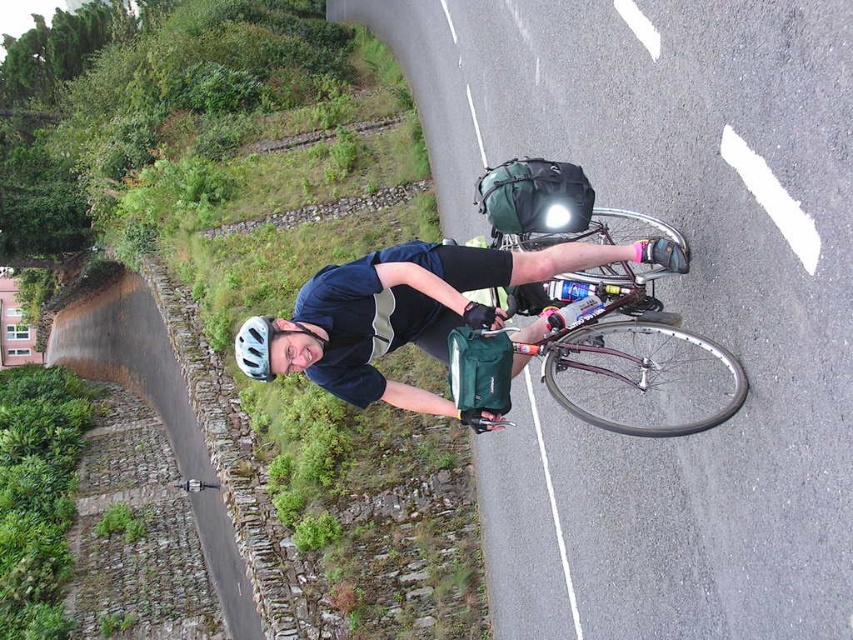
You are a delivery person who needs to carry both the shiny metallic bicycle at right and the white matte bicycle helmet at upper center in your van. The van has a loading width limit of 1.2 meters. Can you fit both items side by side without exceeding the width limit?

The shiny metallic bicycle at right might be wider than white matte bicycle helmet at upper center. Since the bicycle could be wider than 1.2 meters, it might exceed the van loading width limit. Therefore, it is uncertain if both items can fit side by side without exceeding the limit.

You are a cyclist who wants to place a small marker between the two points, point (312, 296) and point (250, 355). Which point is closer to you so you can start placing the marker from there?

Point (312, 296) is further to the viewer than point (250, 355), so the point closer to you is point (250, 355). Start placing the marker from there.

You are a cyclist who just arrived at a scenic spot and wants to take a photo of the matte black helmet at upper center. Where should you position yourself to capture the helmet in the frame?

To capture the matte black helmet at upper center in the frame, position yourself at point (418, 308) where the helmet is located.